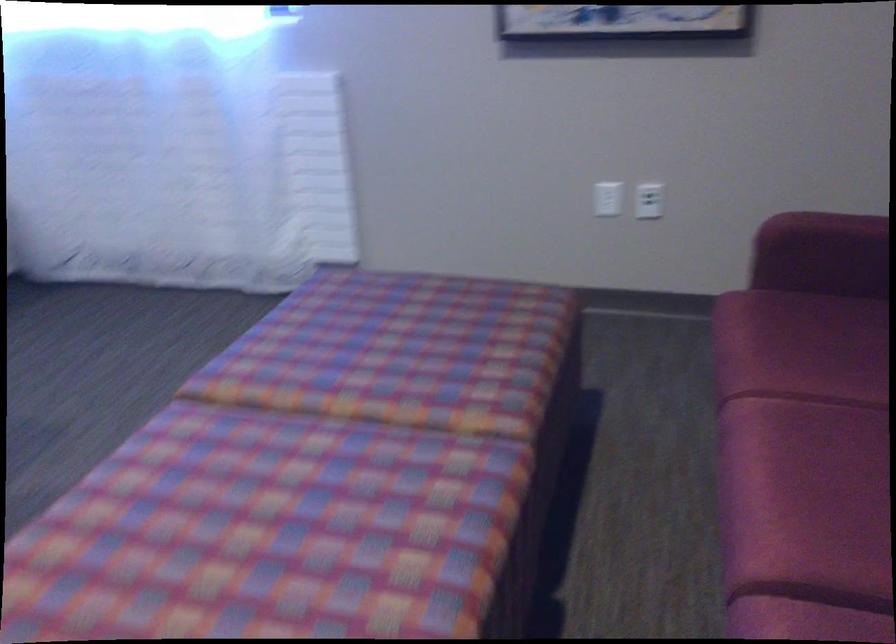
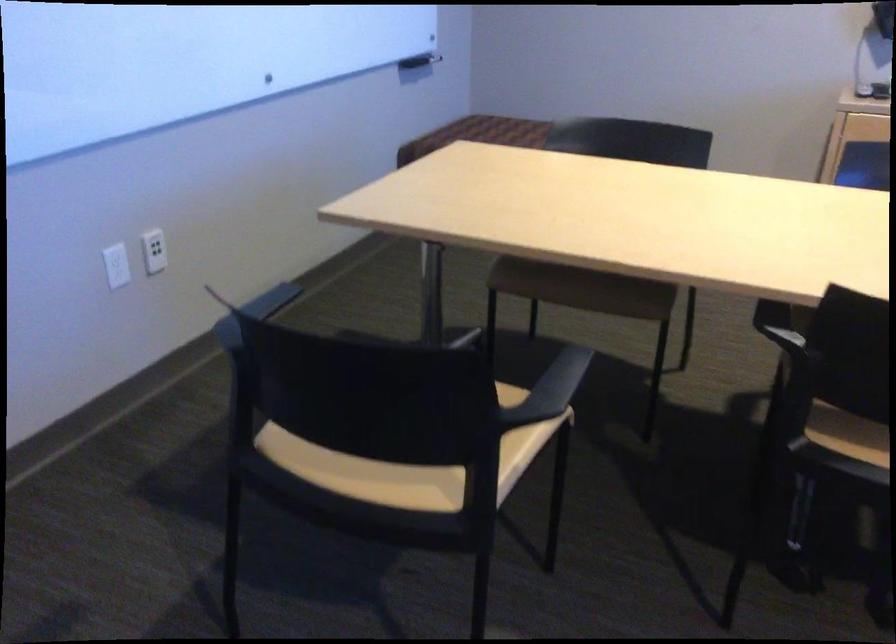
Based on the continuous images, in which direction is the camera rotating?

The camera's rotation is toward left-down.